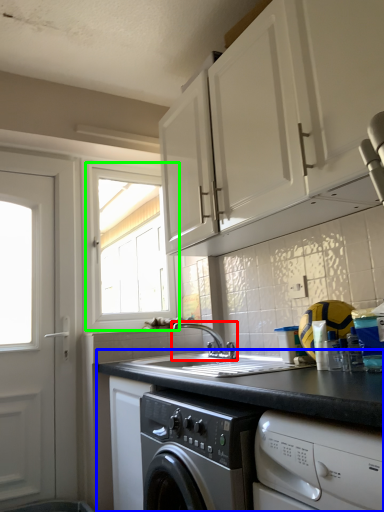
Question: Considering the real-world distances, which object is farthest from tap (highlighted by a red box)? countertop (highlighted by a blue box) or window (highlighted by a green box)?

Choices:
 (A) countertop
 (B) window

Answer: (B)